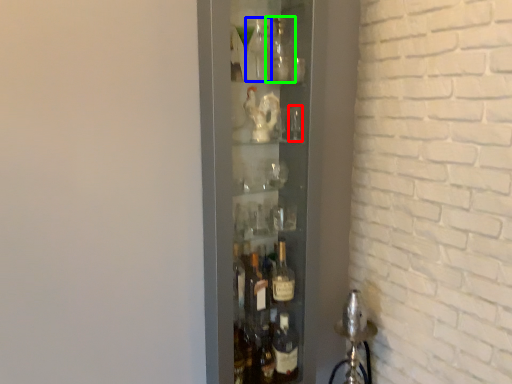
Question: Which is nearer to the shot glass (highlighted by a red box)? bottle (highlighted by a blue box) or bottle (highlighted by a green box).

Choices:
 (A) bottle
 (B) bottle

Answer: (B)